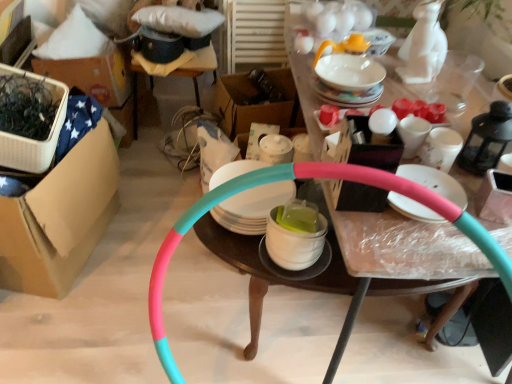
Question: Considering the positions of point (411, 150) and point (420, 152), is point (411, 150) closer or farther from the camera than point (420, 152)?

Choices:
 (A) farther
 (B) closer

Answer: (B)

Question: From a real-world perspective, is white glossy mug at upper right, placed as the third tableware when sorted from top to bottom, positioned above or below white glossy mug at upper right, the fifth tableware positioned from the top?

Choices:
 (A) below
 (B) above

Answer: (A)

Question: Estimate the real-world distances between objects in this image. Which object is farther from the wooden stool at upper left, positioned as the second table in bottom-to-top order?

Choices:
 (A) white glossy mug at upper right, the fifth tableware positioned from the top
 (B) white glossy mug at center, the fifth tableware from the bottom
 (C) porcelain teapot at upper right, the first tableware viewed from the top
 (D) brown cardboard box at left
 (E) white glossy bowl at center, the 8th tableware viewed from the top

Answer: (A)

Question: Considering the real-world distances, which object is farthest from the white glossy mug at upper right, placed as the third tableware when sorted from top to bottom?

Choices:
 (A) white glossy plate at center, the 7th tableware when ordered from top to bottom
 (B) teal-pink plastic hoop at center, the 2th table positioned from the top
 (C) white glossy mug at upper right, arranged as the 4th tableware when ordered from the bottom
 (D) matte white plate at center, which ranks as the third tableware in bottom-to-top order
 (E) white glossy mug at center, the fifth tableware from the bottom

Answer: (B)